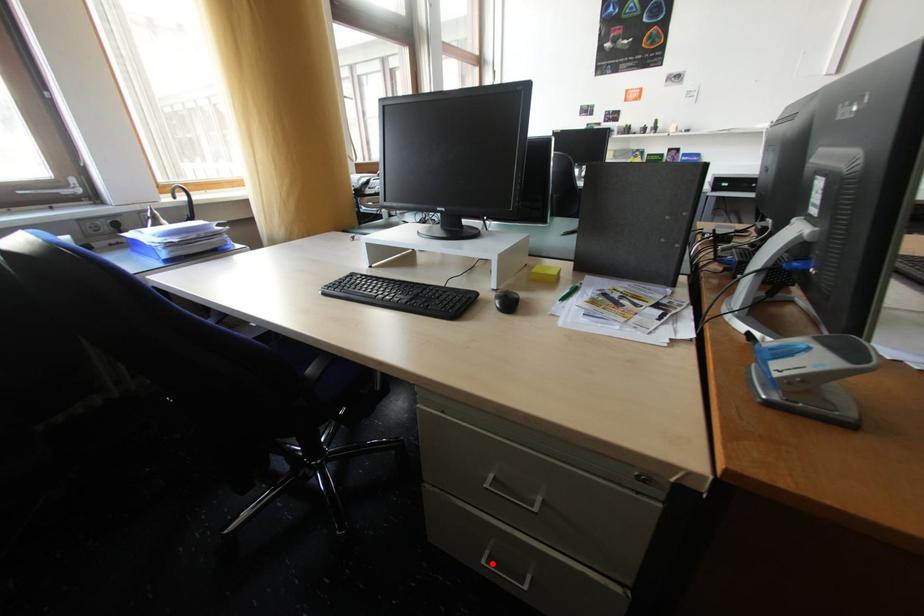
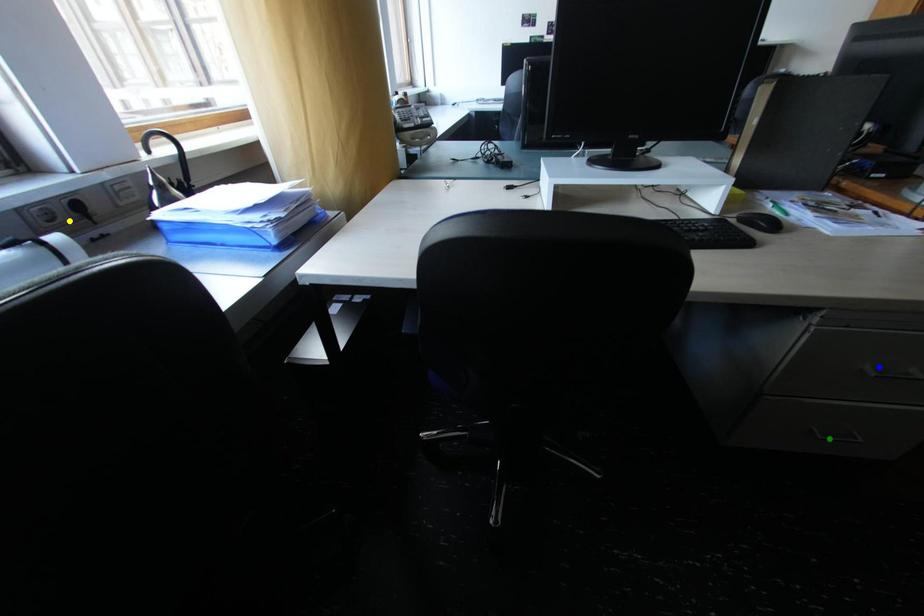
Question: I am providing you with two images of the same scene from different viewpoints. A red point is marked on the first image. You are given multiple points on the second image. Which mark in image 2 goes with the point in image 1?

Choices:
 (A) blue point
 (B) yellow point
 (C) green point

Answer: (C)